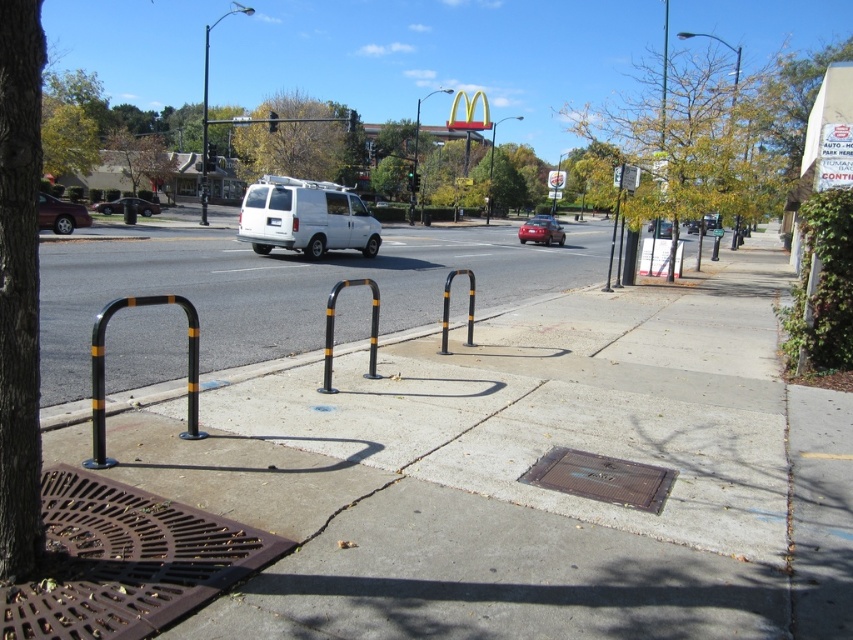
Question: Which point is closer to the camera taking this photo?

Choices:
 (A) (190, 412)
 (B) (202, 164)

Answer: (A)

Question: Considering the relative positions of white matte van at center and brown textured manhole cover at center in the image provided, where is white matte van at center located with respect to brown textured manhole cover at center?

Choices:
 (A) right
 (B) left

Answer: (B)

Question: Which object appears closest to the camera in this image?

Choices:
 (A) black/yellow-painted metal bike rack at center
 (B) matte red car at center
 (C) metallic silver van at center
 (D) matte black sedan at left

Answer: (D)

Question: Which of the following is the closest to the observer?

Choices:
 (A) metallic pole at upper center
 (B) black/yellow striped bike rack at center

Answer: (B)

Question: Is brown metal grate at lower left smaller than metallic silver van at center?

Choices:
 (A) no
 (B) yes

Answer: (A)

Question: Can you confirm if black/yellow striped bike rack at center is thinner than matte black sedan at left?

Choices:
 (A) yes
 (B) no

Answer: (A)